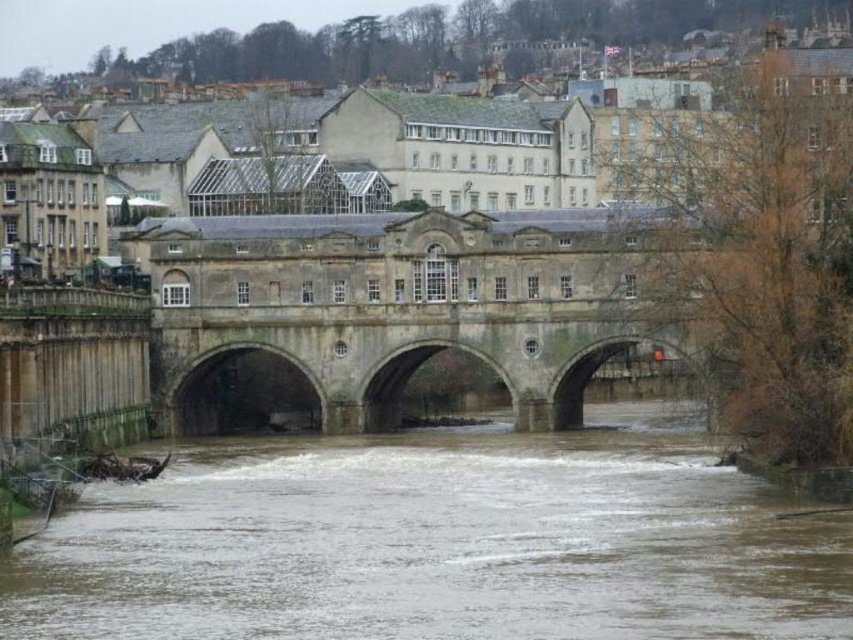
Question: Is brown muddy water at center positioned behind stone bridge at center?

Choices:
 (A) yes
 (B) no

Answer: (B)

Question: Which of the following is the farthest from the observer?

Choices:
 (A) brown muddy water at center
 (B) stone bridge at center

Answer: (B)

Question: Is brown muddy water at center to the right of stone bridge at center from the viewer's perspective?

Choices:
 (A) yes
 (B) no

Answer: (B)

Question: Is brown muddy water at center below stone bridge at center?

Choices:
 (A) yes
 (B) no

Answer: (A)